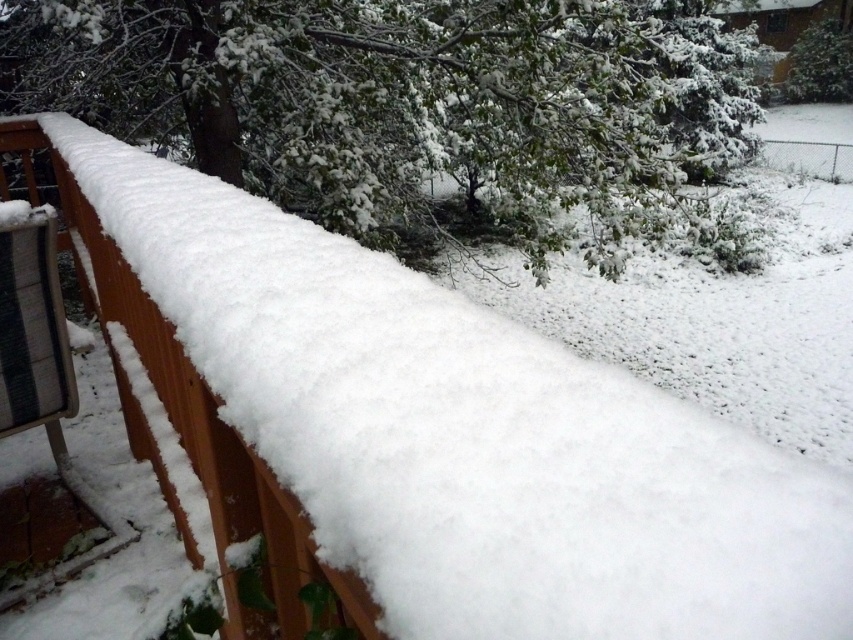
Question: Which point is farther from the camera taking this photo?

Choices:
 (A) (190, 92)
 (B) (816, 74)

Answer: (B)

Question: Is white snow-covered tree at upper center bigger than green matte tree at upper right?

Choices:
 (A) no
 (B) yes

Answer: (B)

Question: Does white snow-covered tree at upper center have a lesser width compared to green matte tree at upper right?

Choices:
 (A) yes
 (B) no

Answer: (B)

Question: Considering the relative positions of white snow-covered tree at upper center and green matte tree at upper right in the image provided, where is white snow-covered tree at upper center located with respect to green matte tree at upper right?

Choices:
 (A) below
 (B) above

Answer: (A)

Question: Which point appears farthest from the camera in this image?

Choices:
 (A) (573, 112)
 (B) (810, 35)

Answer: (B)